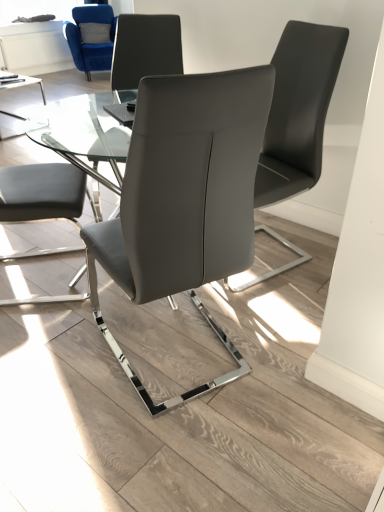
I want to click on vacant space in front of matte gray chair at center, the second chair when ordered from front to back, so click(283, 306).